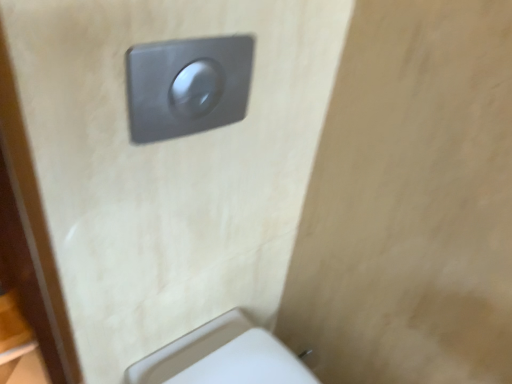
Question: Does white plastic toilet at lower right appear on the right side of metallic gray flush button at upper center?

Choices:
 (A) yes
 (B) no

Answer: (A)

Question: Is white plastic toilet at lower right closer to the viewer compared to metallic gray flush button at upper center?

Choices:
 (A) yes
 (B) no

Answer: (B)

Question: Is white plastic toilet at lower right further to camera compared to metallic gray flush button at upper center?

Choices:
 (A) yes
 (B) no

Answer: (A)

Question: Considering the relative sizes of white plastic toilet at lower right and metallic gray flush button at upper center in the image provided, is white plastic toilet at lower right taller than metallic gray flush button at upper center?

Choices:
 (A) no
 (B) yes

Answer: (A)

Question: Are white plastic toilet at lower right and metallic gray flush button at upper center far apart?

Choices:
 (A) yes
 (B) no

Answer: (B)

Question: From the image's perspective, is white plastic toilet at lower right above metallic gray flush button at upper center?

Choices:
 (A) no
 (B) yes

Answer: (A)

Question: Is white plastic toilet at lower right smaller than satin silver switch at upper center?

Choices:
 (A) no
 (B) yes

Answer: (A)

Question: Considering the relative sizes of white plastic toilet at lower right and satin silver switch at upper center in the image provided, is white plastic toilet at lower right taller than satin silver switch at upper center?

Choices:
 (A) yes
 (B) no

Answer: (A)

Question: Is white plastic toilet at lower right behind satin silver switch at upper center?

Choices:
 (A) no
 (B) yes

Answer: (B)

Question: From a real-world perspective, is white plastic toilet at lower right on top of satin silver switch at upper center?

Choices:
 (A) no
 (B) yes

Answer: (A)

Question: Can you confirm if white plastic toilet at lower right is thinner than satin silver switch at upper center?

Choices:
 (A) no
 (B) yes

Answer: (A)

Question: Is white plastic toilet at lower right surrounding satin silver switch at upper center?

Choices:
 (A) no
 (B) yes

Answer: (A)

Question: From the image's perspective, is metallic gray flush button at upper center below satin silver switch at upper center?

Choices:
 (A) yes
 (B) no

Answer: (A)